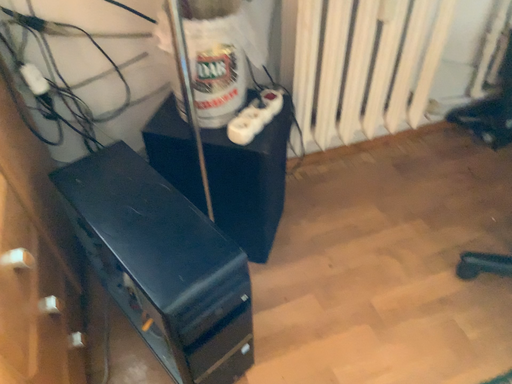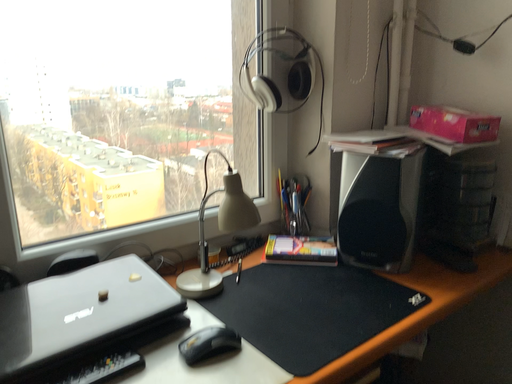
Question: How did the camera likely rotate when shooting the video?

Choices:
 (A) rotated downward
 (B) rotated upward

Answer: (B)